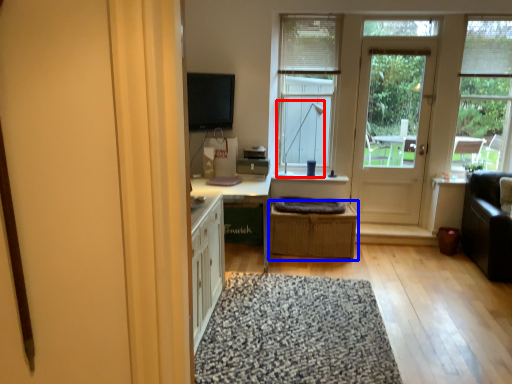
Question: Which point is closer to the camera, lamp (highlighted by a red box) or crate (highlighted by a blue box)?

Choices:
 (A) lamp
 (B) crate

Answer: (B)